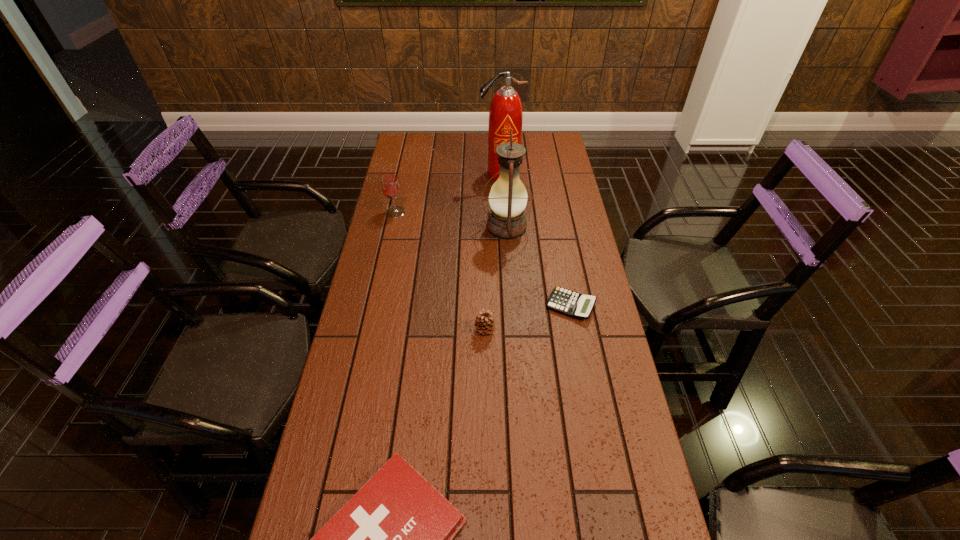
Where is `free space between the oil lamp and the wineglass`? free space between the oil lamp and the wineglass is located at coordinates (451, 219).

You are a GUI agent. You are given a task and a screenshot of the screen. Output one action in this format:
    pyautogui.click(x=<x>, y=<y>)
    Task: Click on the free space between the fourth tallest object and the oil lamp
    Image resolution: width=960 pixels, height=540 pixels.
    Given the screenshot: What is the action you would take?
    pyautogui.click(x=495, y=278)

The height and width of the screenshot is (540, 960). I want to click on free spot between the pinecone and the farthest object, so click(492, 252).

I want to click on free space between the oil lamp and the third shortest object, so click(495, 278).

Find the location of a particular element. This screenshot has width=960, height=540. free space between the oil lamp and the fourth shortest object is located at coordinates (451, 219).

Identify the location of vacant space that's between the farthest object and the fourth shortest object. This screenshot has height=540, width=960. (448, 193).

At what (x,y) coordinates should I click in order to perform the action: click on the fifth closest object to the fire extinguisher. Please return your answer as a coordinate pair (x, y). This screenshot has width=960, height=540. Looking at the image, I should click on (393, 539).

This screenshot has width=960, height=540. What are the coordinates of `object identified as the closest to the fire extinguisher` in the screenshot? It's located at pos(508,197).

Where is `vacant space that satisfies the following two spatial constraints: 1. on the back side of the third shortest object; 2. on the left side of the shortest object`? The width and height of the screenshot is (960, 540). vacant space that satisfies the following two spatial constraints: 1. on the back side of the third shortest object; 2. on the left side of the shortest object is located at coordinates (485, 306).

Identify the location of vacant point that satisfies the following two spatial constraints: 1. on the front side of the fourth tallest object; 2. on the right side of the third tallest object. (370, 330).